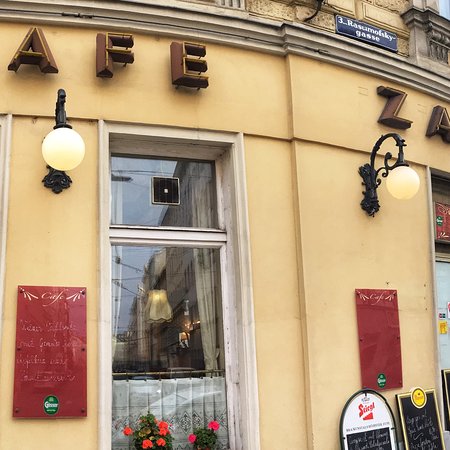
Find the location of `light 2`. light 2 is located at coordinates (58, 147).